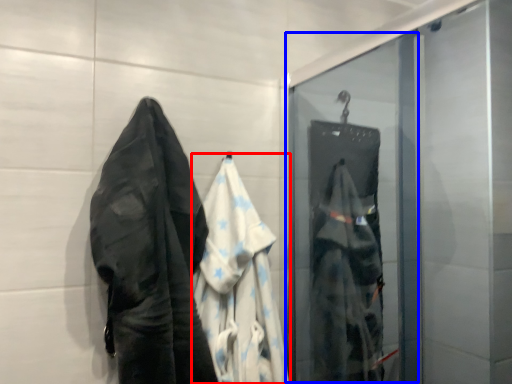
Question: Among these objects, which one is farthest to the camera, garment (highlighted by a red box) or screen door (highlighted by a blue box)?

Choices:
 (A) garment
 (B) screen door

Answer: (B)